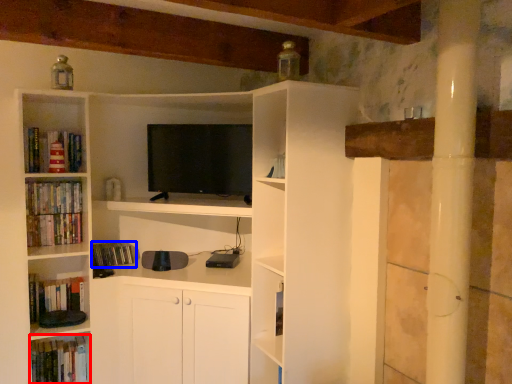
Question: Which of the following is the farthest to the observer, book (highlighted by a red box) or book (highlighted by a blue box)?

Choices:
 (A) book
 (B) book

Answer: (B)